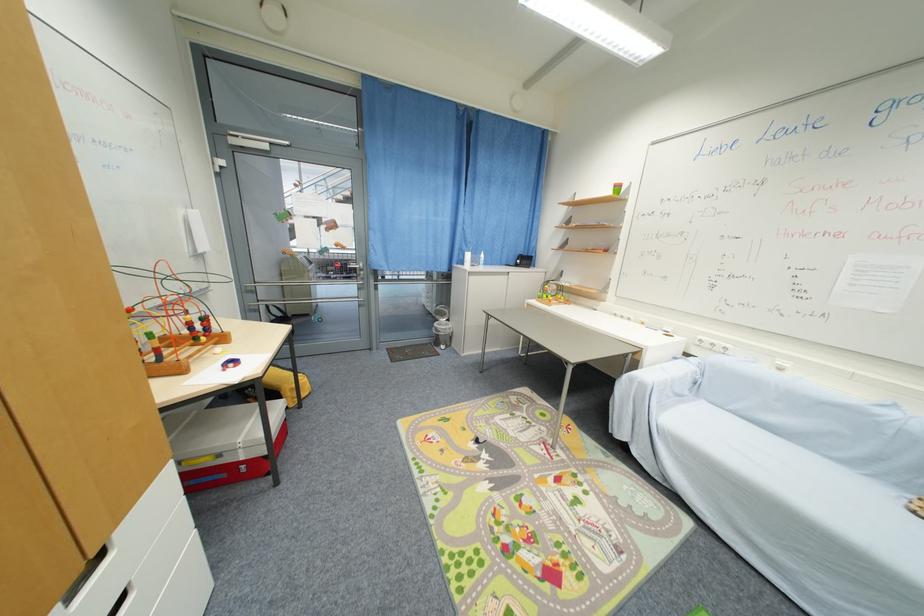
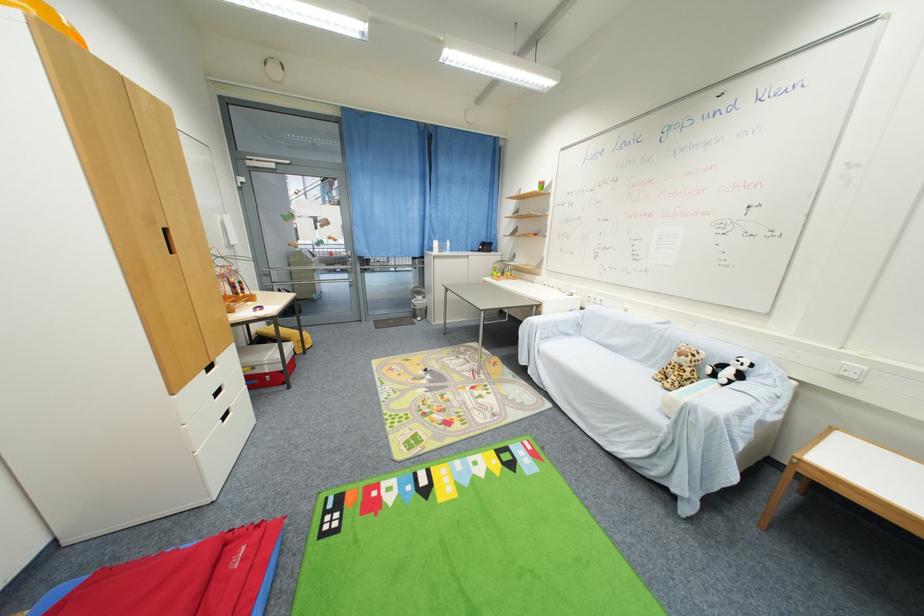
Locate, in the second image, the point that corresponds to (x=441, y=326) in the first image.

(418, 302)